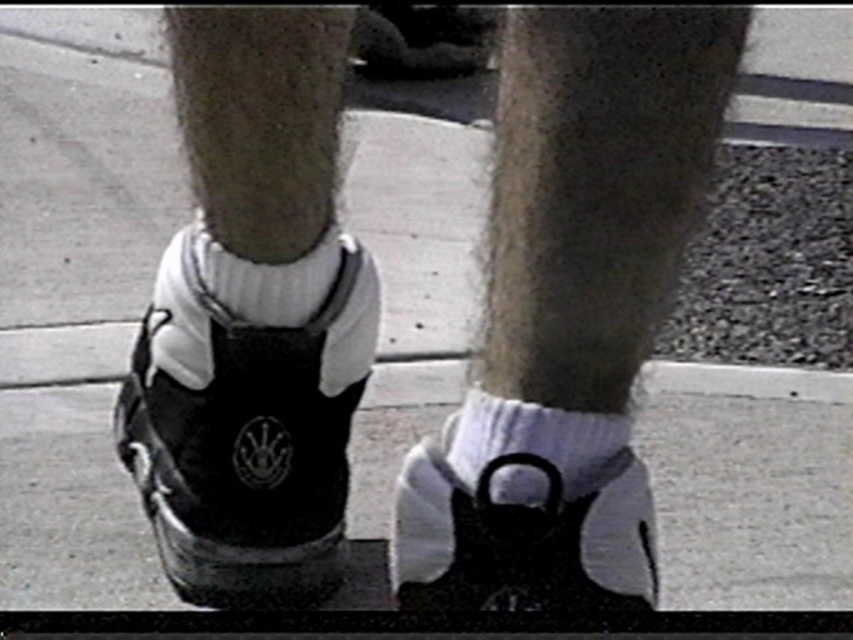
You are a photographer trying to capture the two points in the image. Which point, point (618,554) or point (315,492), is closer to your camera lens?

Point (618,554) is closer to the camera lens than point (315,492).

You are a photographer trying to frame a shot of the black matte sneaker at center. The camera is set to focus at coordinates 0.697, 0.292. Will the sneaker be in focus?

Yes, the black matte sneaker at center is located exactly at the focus coordinates (248, 445), so it will be in focus.

You are a photographer trying to capture the black matte sneaker at center in your shot. The camera is positioned at point A, which is at coordinate 0.5, 0.5. The point of interest is at coordinate (248,445). To ensure the sneaker is in focus, you need to adjust the camera focus point. Is the black matte sneaker at center located above or below the camera focus point at 0.5, 0.5?

The point of interest for the black matte sneaker at center is at (248,445). Comparing this to the camera focus point at 0.5, 0.5, the sneaker is located below the focus point since the y coordinate 0.292 is lower than 0.5.